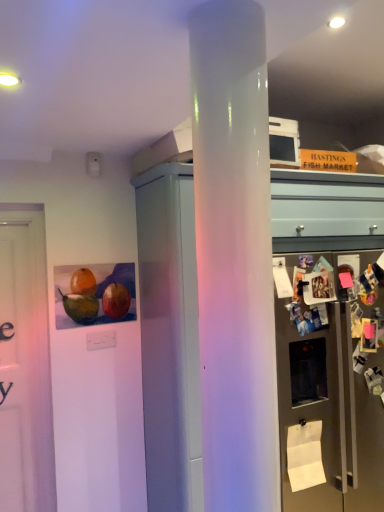
Question: From the image's perspective, is white glossy cabinet at center above satin silver refrigerator at right?

Choices:
 (A) yes
 (B) no

Answer: (B)

Question: Is white glossy cabinet at center positioned behind satin silver refrigerator at right?

Choices:
 (A) no
 (B) yes

Answer: (A)

Question: Can you confirm if white glossy cabinet at center is shorter than satin silver refrigerator at right?

Choices:
 (A) yes
 (B) no

Answer: (B)

Question: Can you confirm if white glossy cabinet at center is positioned to the right of satin silver refrigerator at right?

Choices:
 (A) yes
 (B) no

Answer: (B)

Question: Is white glossy cabinet at center smaller than satin silver refrigerator at right?

Choices:
 (A) yes
 (B) no

Answer: (B)

Question: Considering the relative positions of white paper at lower right and satin silver refrigerator at right in the image provided, is white paper at lower right to the left or to the right of satin silver refrigerator at right?

Choices:
 (A) left
 (B) right

Answer: (A)

Question: Looking at their shapes, would you say white paper at lower right is wider or thinner than satin silver refrigerator at right?

Choices:
 (A) wide
 (B) thin

Answer: (B)

Question: From the image's perspective, is white paper at lower right positioned above or below satin silver refrigerator at right?

Choices:
 (A) below
 (B) above

Answer: (A)

Question: Choose the correct answer: Is white paper at lower right inside satin silver refrigerator at right or outside it?

Choices:
 (A) inside
 (B) outside

Answer: (A)

Question: Based on their sizes in the image, would you say satin silver refrigerator at right is bigger or smaller than white glossy cabinet at center?

Choices:
 (A) small
 (B) big

Answer: (A)

Question: In terms of width, does satin silver refrigerator at right look wider or thinner when compared to white glossy cabinet at center?

Choices:
 (A) wide
 (B) thin

Answer: (B)

Question: Is satin silver refrigerator at right situated inside white glossy cabinet at center or outside?

Choices:
 (A) inside
 (B) outside

Answer: (B)

Question: In terms of height, does satin silver refrigerator at right look taller or shorter compared to white glossy cabinet at center?

Choices:
 (A) short
 (B) tall

Answer: (A)

Question: Is white glossy cabinet at center inside the boundaries of satin silver refrigerator at right, or outside?

Choices:
 (A) outside
 (B) inside

Answer: (A)

Question: From the image's perspective, relative to satin silver refrigerator at right, is white glossy cabinet at center above or below?

Choices:
 (A) below
 (B) above

Answer: (A)